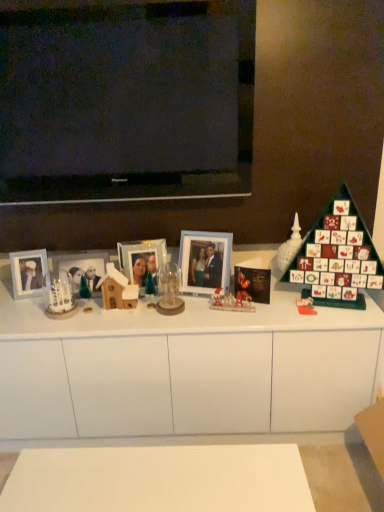
Locate an element on the screen. The height and width of the screenshot is (512, 384). free spot to the right of clear glass ornament at center, which is counted as the second toy, starting from the left is located at coordinates click(213, 309).